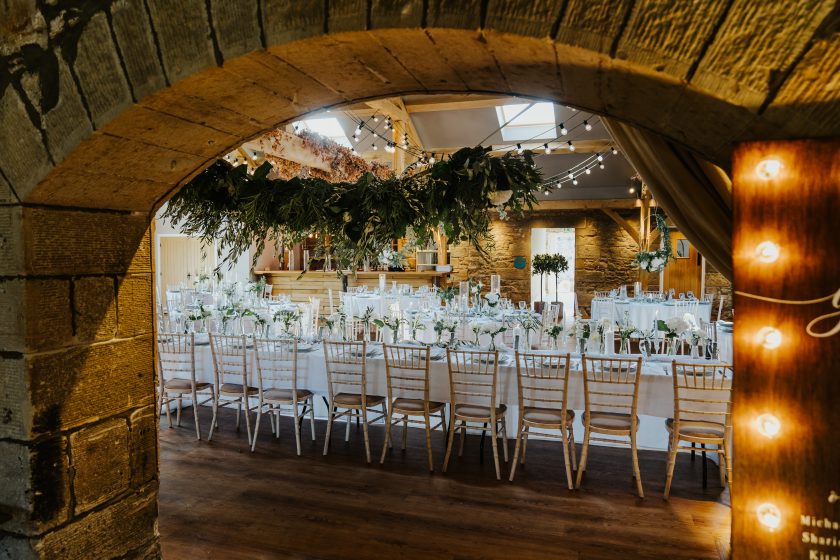
Where is `hardwood floor`? Image resolution: width=840 pixels, height=560 pixels. hardwood floor is located at coordinates (x=415, y=547).